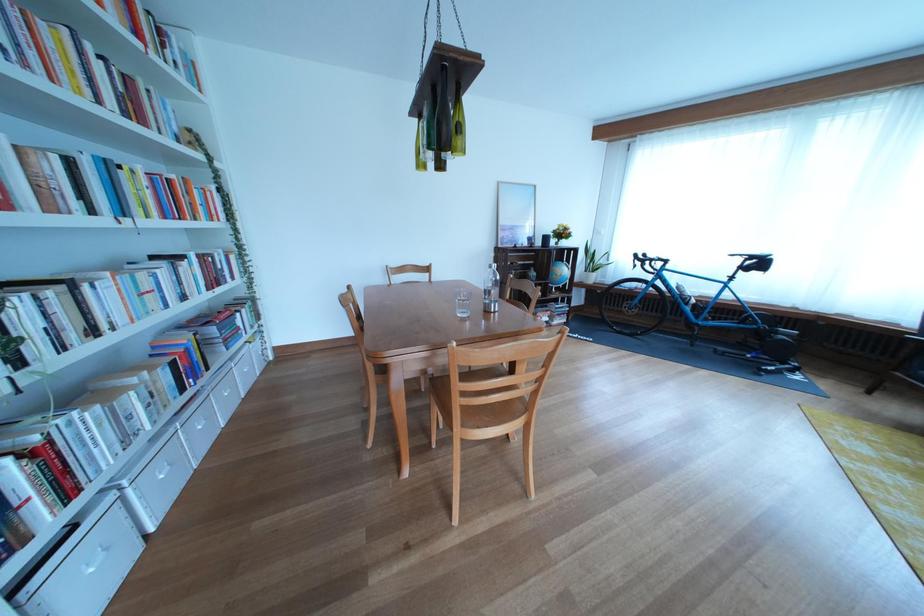
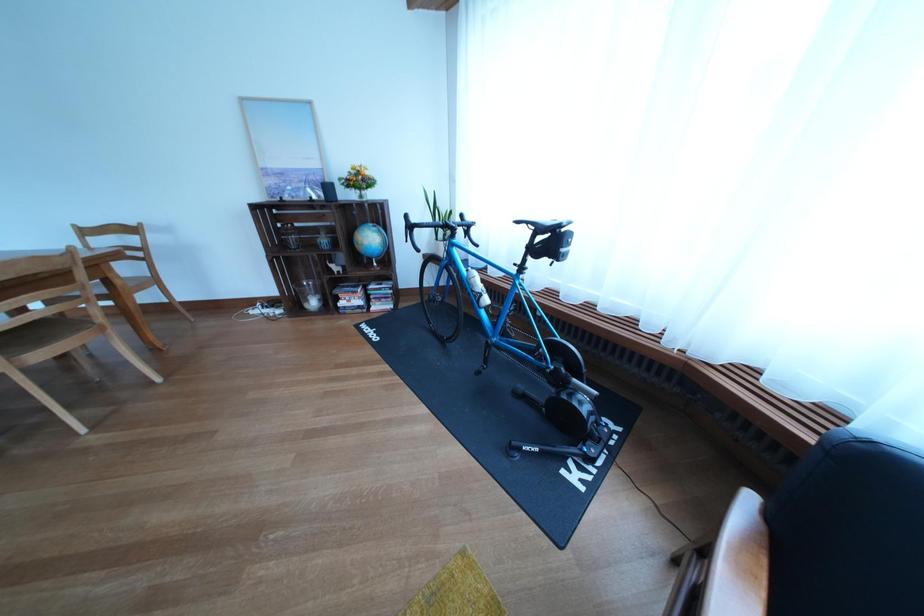
The point at (525, 233) is marked in the first image. Where is the corresponding point in the second image?

(294, 179)